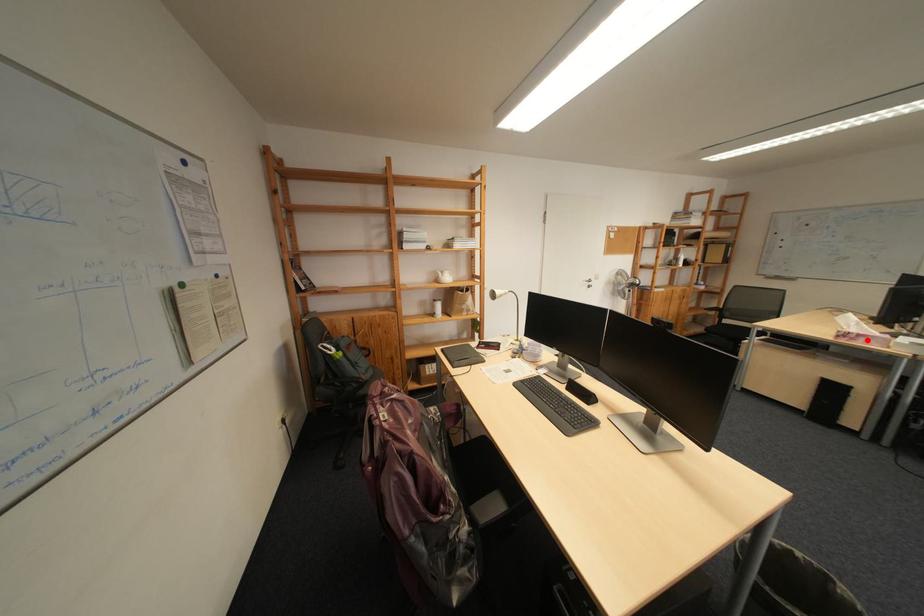
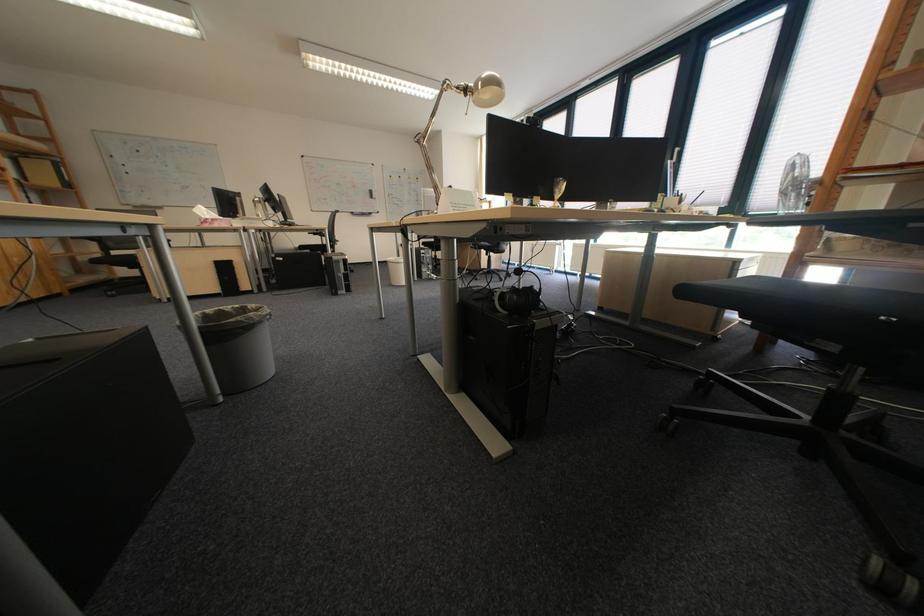
Where in the second image is the point corresponding to the highlighted location from the first image?

(225, 225)